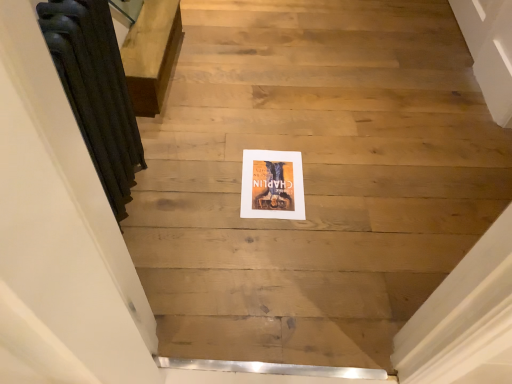
Question: Is dark gray cast iron radiator at left at the left side of white matte picture frame at center?

Choices:
 (A) no
 (B) yes

Answer: (B)

Question: Does dark gray cast iron radiator at left have a lesser height compared to white matte picture frame at center?

Choices:
 (A) yes
 (B) no

Answer: (B)

Question: Is dark gray cast iron radiator at left behind white matte picture frame at center?

Choices:
 (A) no
 (B) yes

Answer: (A)

Question: Does dark gray cast iron radiator at left turn towards white matte picture frame at center?

Choices:
 (A) yes
 (B) no

Answer: (A)

Question: Does dark gray cast iron radiator at left have a greater height compared to white matte picture frame at center?

Choices:
 (A) no
 (B) yes

Answer: (B)

Question: Considering the relative sizes of dark gray cast iron radiator at left and white matte picture frame at center in the image provided, is dark gray cast iron radiator at left thinner than white matte picture frame at center?

Choices:
 (A) yes
 (B) no

Answer: (A)

Question: Is white matte picture frame at center not within dark gray cast iron radiator at left?

Choices:
 (A) yes
 (B) no

Answer: (A)

Question: Is white matte picture frame at center shorter than dark gray cast iron radiator at left?

Choices:
 (A) yes
 (B) no

Answer: (A)

Question: From the image's perspective, is white matte picture frame at center beneath dark gray cast iron radiator at left?

Choices:
 (A) yes
 (B) no

Answer: (A)

Question: Is white matte picture frame at center behind dark gray cast iron radiator at left?

Choices:
 (A) yes
 (B) no

Answer: (A)

Question: Are white matte picture frame at center and dark gray cast iron radiator at left far apart?

Choices:
 (A) no
 (B) yes

Answer: (A)

Question: From the image's perspective, is white matte picture frame at center above dark gray cast iron radiator at left?

Choices:
 (A) no
 (B) yes

Answer: (A)

Question: Is point (296, 172) closer or farther from the camera than point (104, 77)?

Choices:
 (A) farther
 (B) closer

Answer: (A)